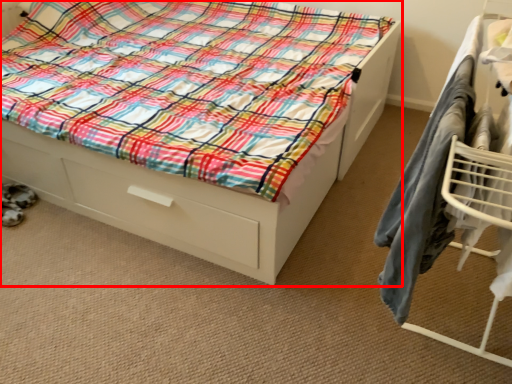
Question: Considering the relative positions of bed (annotated by the red box) and furniture in the image provided, where is bed (annotated by the red box) located with respect to the staircase?

Choices:
 (A) left
 (B) right

Answer: (A)